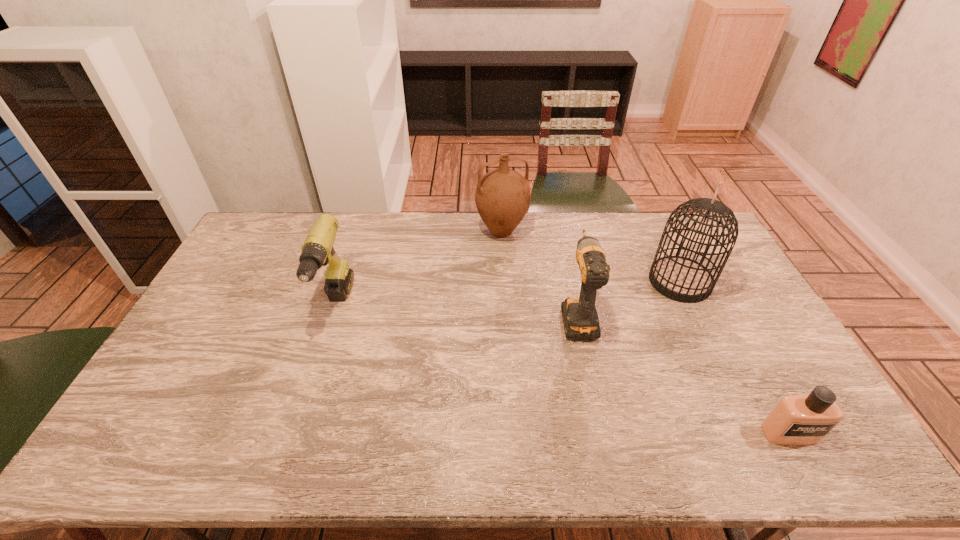
Locate an element on the screen. This screenshot has width=960, height=540. free space located with the drill bit of the third object from left to right facing forward is located at coordinates (560, 232).

Where is `free space located 0.350m with the drill bit of the third object from left to right facing forward`? This screenshot has width=960, height=540. free space located 0.350m with the drill bit of the third object from left to right facing forward is located at coordinates (558, 226).

Identify the location of vacant space situated 0.290m on the handle side of the leftmost object. (294, 435).

Locate an element on the screen. Image resolution: width=960 pixels, height=540 pixels. object that is at the far edge is located at coordinates (502, 197).

At what (x,y) coordinates should I click in order to perform the action: click on object located in the near edge section of the desktop. Please return your answer as a coordinate pair (x, y). This screenshot has height=540, width=960. Looking at the image, I should click on (798, 419).

This screenshot has height=540, width=960. In order to click on birdcage that is positioned at the right edge in this screenshot , I will do `click(679, 278)`.

Identify the location of perfume that is at the right edge. The image size is (960, 540). (798, 419).

Locate an element on the screen. This screenshot has height=540, width=960. object that is at the near right corner is located at coordinates (798, 419).

You are a GUI agent. You are given a task and a screenshot of the screen. Output one action in this format:
    pyautogui.click(x=<x>, y=<y>)
    Task: Click on the free region at the far edge of the desktop
    The image size is (960, 540).
    Given the screenshot: What is the action you would take?
    pyautogui.click(x=389, y=219)

What are the coordinates of `blank space at the near edge of the desktop` in the screenshot? It's located at (327, 448).